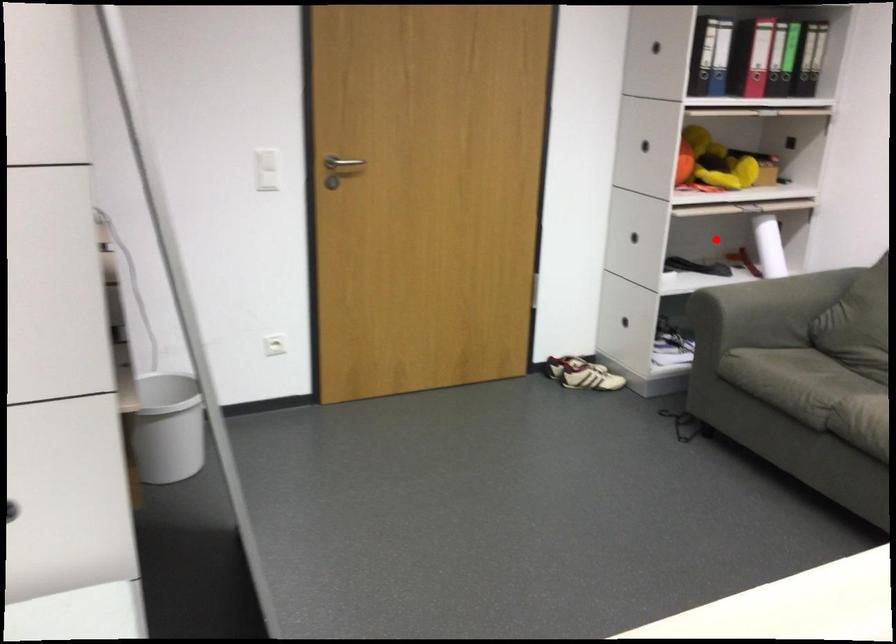
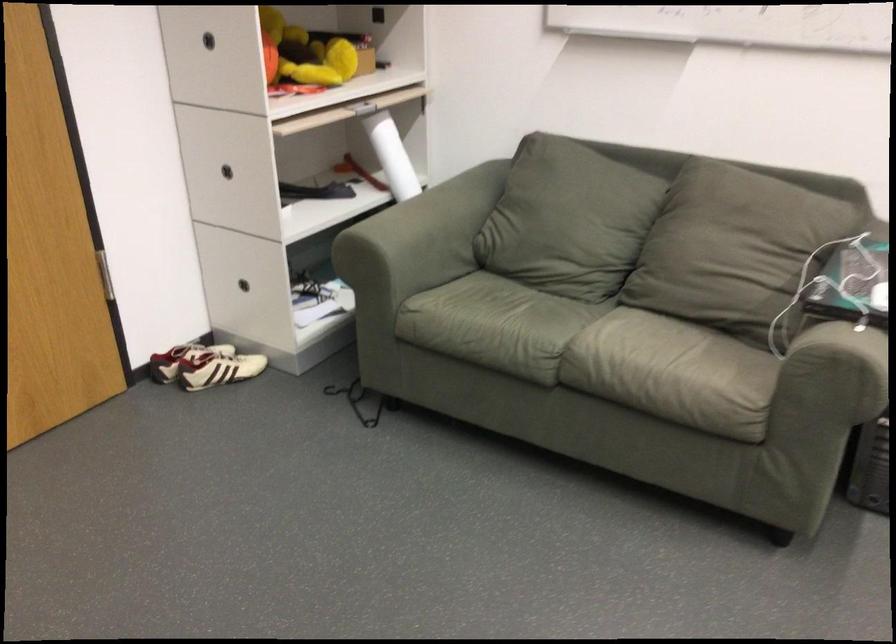
Question: A red point is marked in image1. In image2, is the corresponding 3D point closer to the camera or farther? Reply with the corresponding letter.

Choices:
 (A) The corresponding 3D point is closer.
 (B) The corresponding 3D point is farther.

Answer: (A)